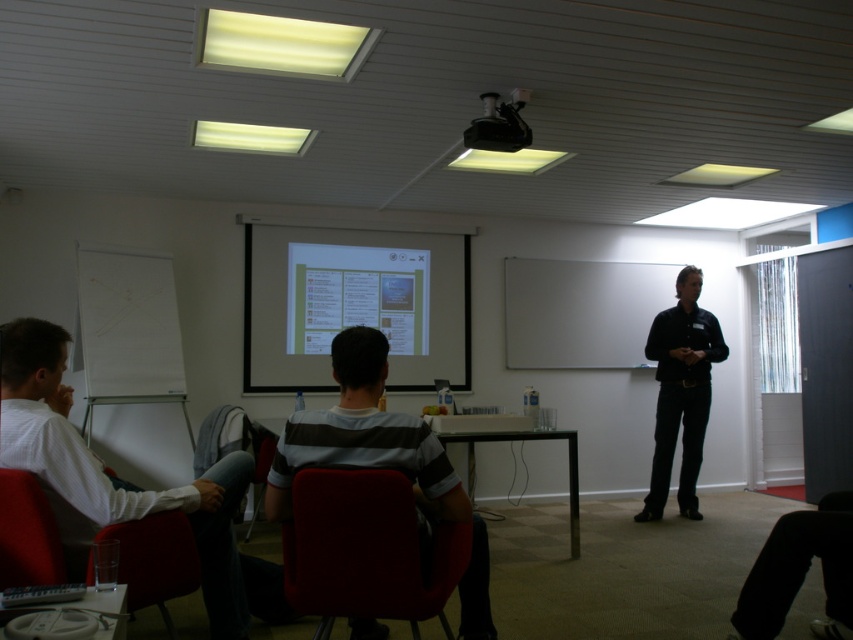
Image resolution: width=853 pixels, height=640 pixels. Describe the element at coordinates (354, 301) in the screenshot. I see `matte white projector screen at center` at that location.

Based on the photo, between matte white projector screen at center and striped cotton shirt at center, which one is positioned lower?

striped cotton shirt at center is lower down.

Is point (465, 339) in front of point (343, 461)?

No, it is behind (343, 461).

Identify the location of matte white projector screen at center. This screenshot has height=640, width=853. (354, 301).

Is point (372, 472) closer to viewer compared to point (683, 445)?

Yes, point (372, 472) is in front of point (683, 445).

The image size is (853, 640). What do you see at coordinates (364, 548) in the screenshot?
I see `velvet red chair at center` at bounding box center [364, 548].

Identify the location of velvet red chair at center. (364, 548).

The width and height of the screenshot is (853, 640). In order to click on velvet red chair at center in this screenshot , I will do `click(364, 548)`.

Is point (402, 611) behind point (177, 579)?

No.

At what (x,y) coordinates should I click in order to perform the action: click on velvet red chair at center. Please return your answer as a coordinate pair (x, y). Looking at the image, I should click on (364, 548).